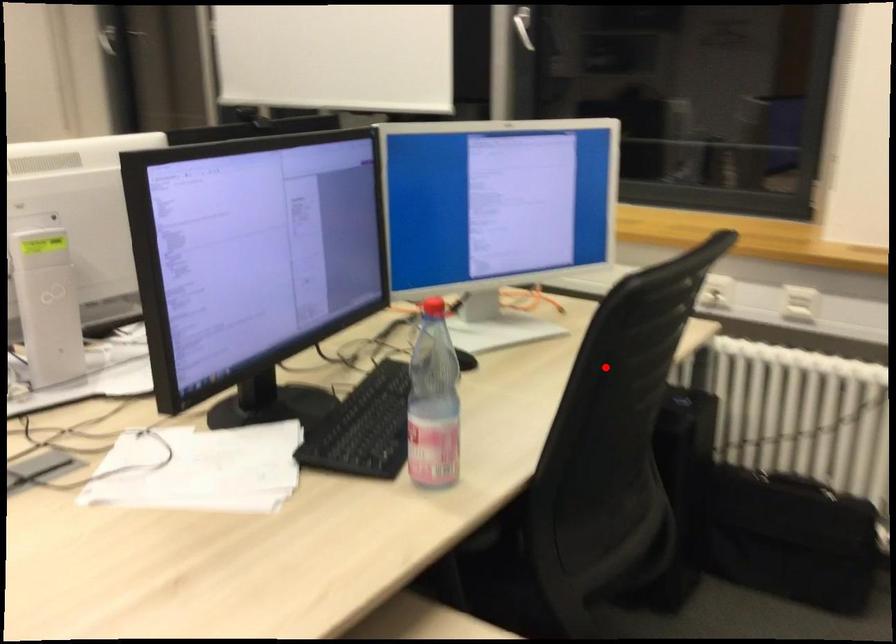
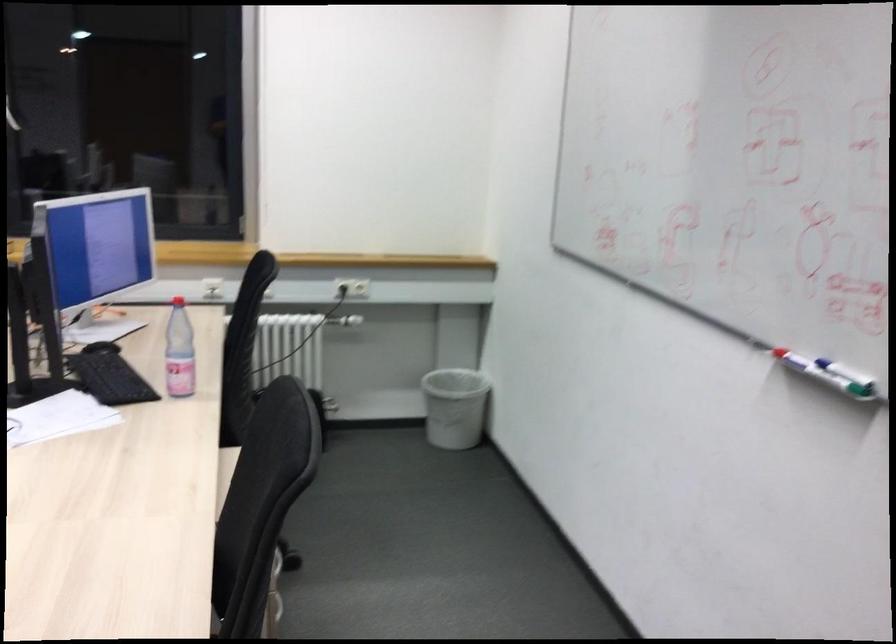
Find the pixel in the second image that matches the highlighted location in the first image.

(246, 319)